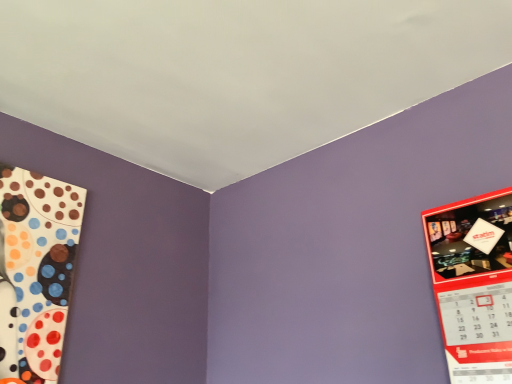
Where is `red glossy calendar at right`? This screenshot has height=384, width=512. red glossy calendar at right is located at coordinates (474, 284).

Describe the element at coordinates (474, 284) in the screenshot. The image size is (512, 384). I see `red glossy calendar at right` at that location.

Where is `red glossy calendar at right`? Image resolution: width=512 pixels, height=384 pixels. red glossy calendar at right is located at coordinates (474, 284).